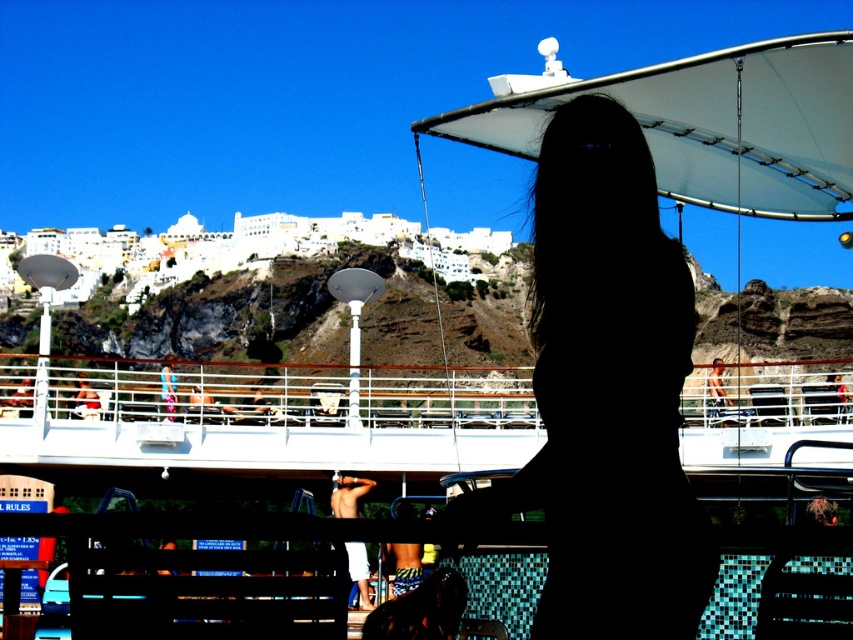
You are a photographer trying to capture a clear shot of the tan skin man at upper right and the white fabric towel at upper center. Which object is wider in the image?

The tan skin man at upper right might be wider than white fabric towel at upper center.

Looking at this image, you are a photographer on the cruise ship deck. You want to take a photo of the tan skin man at upper right and the white fabric towel at upper center. Based on their positions, which object is located further to the right?

The tan skin man at upper right is to the right of the white fabric towel at upper center, so the tan skin man at upper right is located further to the right.